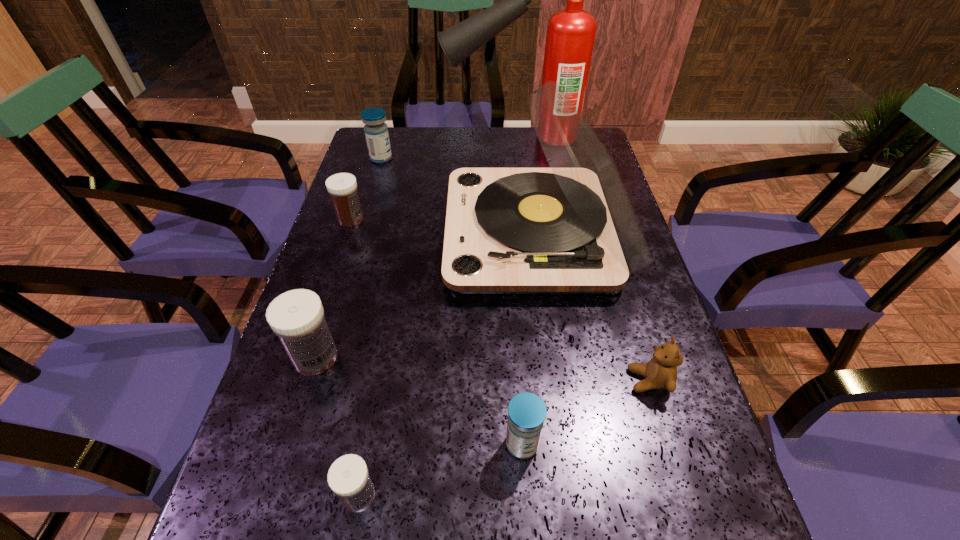
The image size is (960, 540). What are the coordinates of `the farthest white medicine` in the screenshot? It's located at (342, 187).

Find the location of a particular element. The width and height of the screenshot is (960, 540). teddy bear is located at coordinates (660, 372).

Image resolution: width=960 pixels, height=540 pixels. I want to click on the rightmost white medicine, so tap(348, 477).

Image resolution: width=960 pixels, height=540 pixels. I want to click on the nearest white medicine, so click(348, 477).

Where is `vacant position located at the nozzle of the farthest object`? This screenshot has height=540, width=960. vacant position located at the nozzle of the farthest object is located at coordinates coord(423,137).

Locate an element on the screen. The width and height of the screenshot is (960, 540). free spot located at the nozzle of the farthest object is located at coordinates [420, 137].

This screenshot has height=540, width=960. Find the location of `free space located at the nozzle of the farthest object`. free space located at the nozzle of the farthest object is located at coordinates (364, 137).

The width and height of the screenshot is (960, 540). In order to click on free location located with the tonearm facing the front of the seventh shortest object in this screenshot , I will do `click(420, 234)`.

The width and height of the screenshot is (960, 540). I want to click on blank area located 0.240m with the tonearm facing the front of the seventh shortest object, so click(x=354, y=234).

In order to click on free space located 0.200m with the tonearm facing the front of the seventh shortest object in this screenshot , I will do `click(370, 234)`.